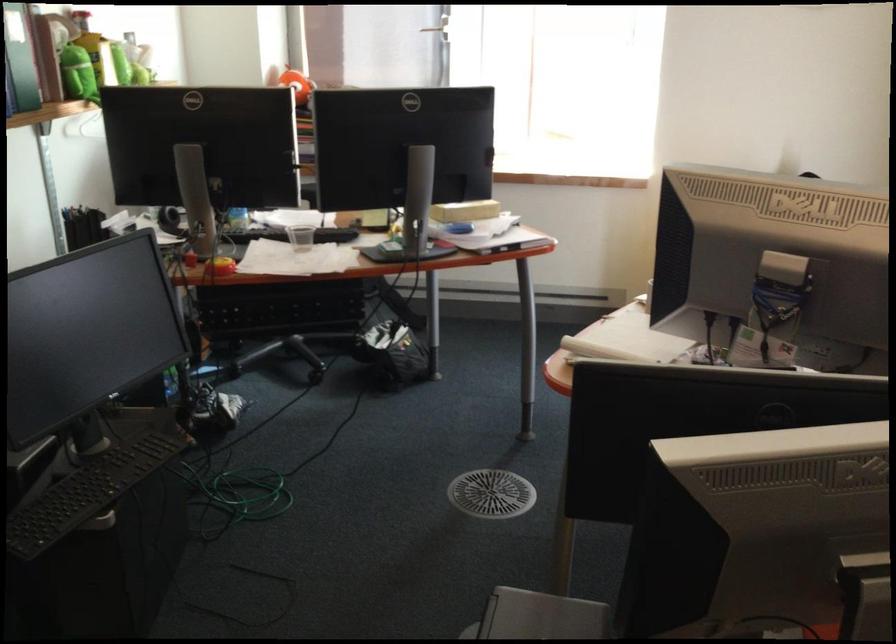
The location [756,525] corresponds to which object?

It refers to a white paper box.